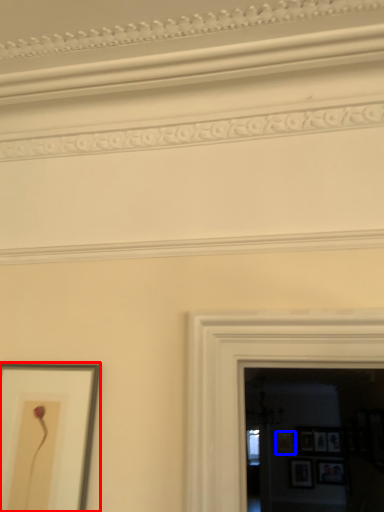
Question: Which object is closer to the camera taking this photo, picture frame (highlighted by a red box) or picture frame (highlighted by a blue box)?

Choices:
 (A) picture frame
 (B) picture frame

Answer: (A)